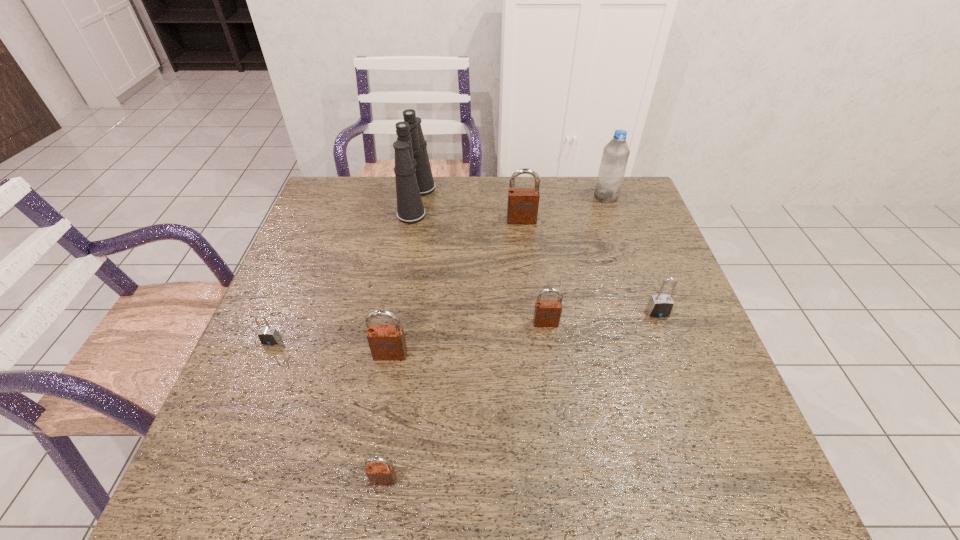
Locate an element on the screen. binoculars is located at coordinates (413, 175).

Identify the location of the seventh shortest object. The height and width of the screenshot is (540, 960). (615, 156).

The width and height of the screenshot is (960, 540). In order to click on blue water bottle in this screenshot , I will do `click(615, 156)`.

Where is `the farthest padlock`? The width and height of the screenshot is (960, 540). the farthest padlock is located at coordinates (522, 208).

Identify the location of the tallest padlock. The height and width of the screenshot is (540, 960). (522, 208).

The width and height of the screenshot is (960, 540). Find the location of `the second nearest padlock`. the second nearest padlock is located at coordinates (387, 342).

In order to click on the fourth tallest object in this screenshot , I will do `click(387, 342)`.

The height and width of the screenshot is (540, 960). What are the coordinates of `the bigger gray padlock` in the screenshot? It's located at (660, 305).

You are a GUI agent. You are given a task and a screenshot of the screen. Output one action in this format:
    pyautogui.click(x=<x>, y=<y>)
    Task: Click on the rightmost padlock
    
    Given the screenshot: What is the action you would take?
    pyautogui.click(x=660, y=305)

This screenshot has height=540, width=960. I want to click on the fourth nearest padlock, so click(x=547, y=313).